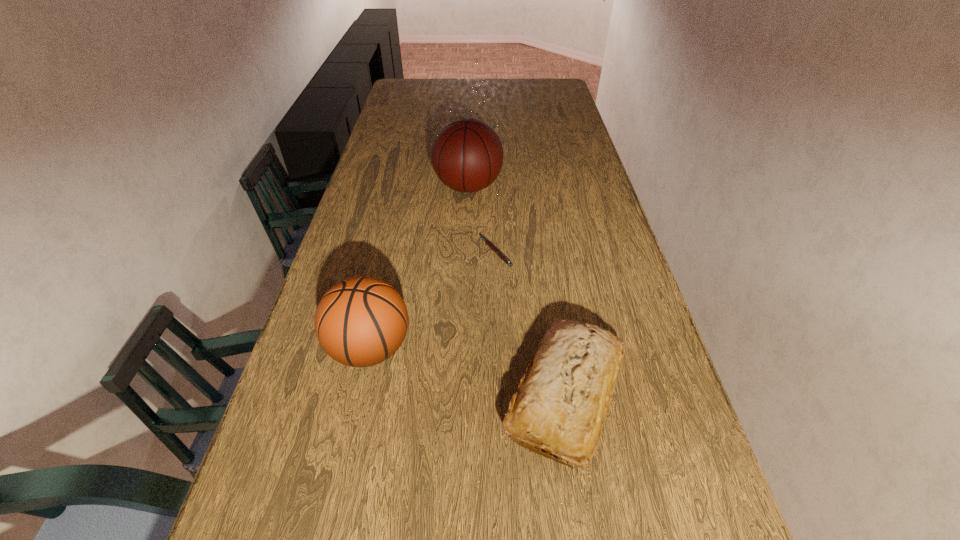
Where is `vacant area that lies between the third tallest object and the pen`? vacant area that lies between the third tallest object and the pen is located at coordinates (531, 323).

At what (x,y) coordinates should I click in order to perform the action: click on empty space between the third nearest object and the shorter basketball. Please return your answer as a coordinate pair (x, y). This screenshot has height=540, width=960. Looking at the image, I should click on (433, 300).

Image resolution: width=960 pixels, height=540 pixels. I want to click on empty space between the tallest object and the bread, so click(x=517, y=291).

Find the location of a particular element. This screenshot has width=960, height=540. free space between the nearer basketball and the bread is located at coordinates coord(468,372).

Where is `free space between the third tallest object and the shorter basketball`? This screenshot has width=960, height=540. free space between the third tallest object and the shorter basketball is located at coordinates (468, 372).

Find the location of a particular element. This screenshot has height=540, width=960. vacant point located between the nearer basketball and the second farthest object is located at coordinates (433, 300).

I want to click on vacant region between the second farthest object and the second shortest object, so click(531, 323).

This screenshot has width=960, height=540. Find the location of `vacant area that lies between the farther basketball and the nearer basketball`. vacant area that lies between the farther basketball and the nearer basketball is located at coordinates (420, 267).

At what (x,y) coordinates should I click in order to perform the action: click on free area in between the nearer basketball and the tallest object. Please return your answer as a coordinate pair (x, y). The width and height of the screenshot is (960, 540). Looking at the image, I should click on (420, 267).

Image resolution: width=960 pixels, height=540 pixels. In order to click on unoccupied area between the third tallest object and the nearer basketball in this screenshot , I will do `click(468, 372)`.